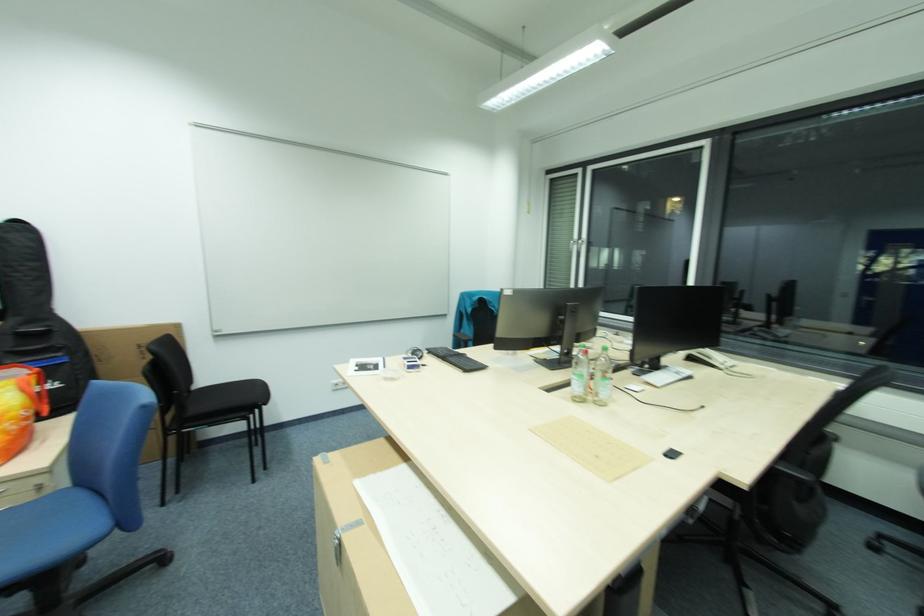
Locate an element on the screen. The image size is (924, 616). white window handle is located at coordinates (579, 245).